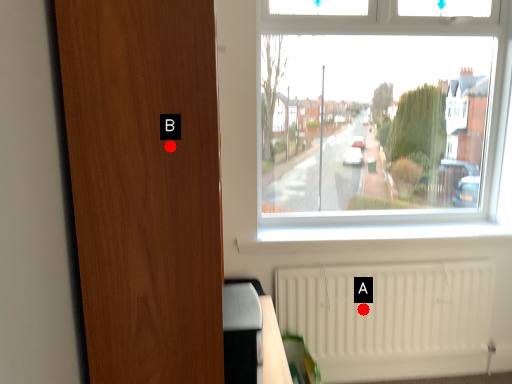
Question: Two points are circled on the image, labeled by A and B beside each circle. Which point is farther from the camera taking this photo?

Choices:
 (A) A is further
 (B) B is further

Answer: (A)